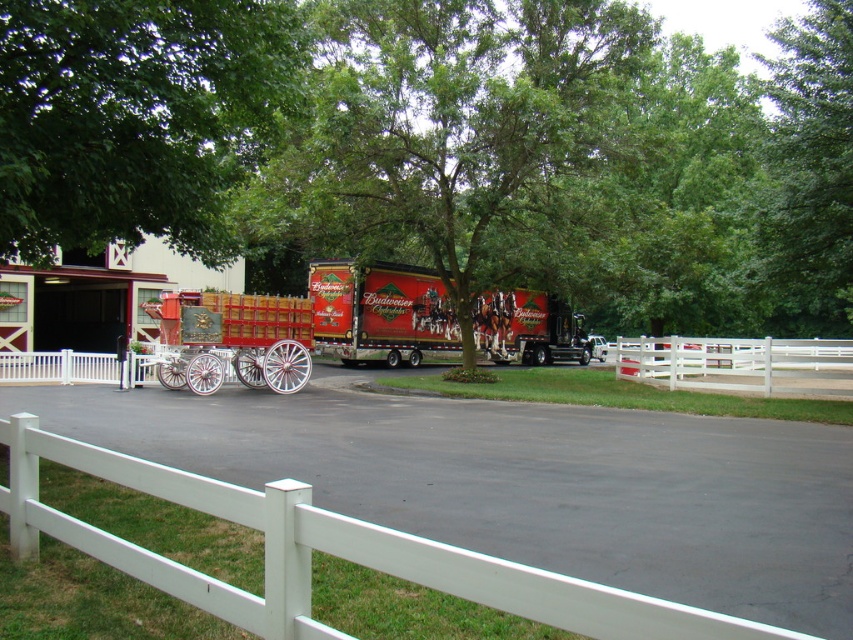
Question: Is green leafy tree at upper left to the right of shiny red trailer truck at center from the viewer's perspective?

Choices:
 (A) no
 (B) yes

Answer: (A)

Question: Does green leafy tree at upper center have a larger size compared to polished wood wagon at center?

Choices:
 (A) yes
 (B) no

Answer: (A)

Question: Which point is closer to the camera?

Choices:
 (A) (844, 212)
 (B) (187, 387)

Answer: (A)

Question: Which of the following is the closest to the observer?

Choices:
 (A) shiny red trailer truck at center
 (B) white wooden fence at center
 (C) green leafy tree at center
 (D) green leafy tree at upper left

Answer: (D)

Question: Which point is farther from the camera taking this photo?

Choices:
 (A) (264, 326)
 (B) (836, 266)
 (C) (730, 369)
 (D) (312, 296)

Answer: (D)

Question: Can you confirm if green leafy tree at center is positioned to the left of white wooden fence at center?

Choices:
 (A) no
 (B) yes

Answer: (B)